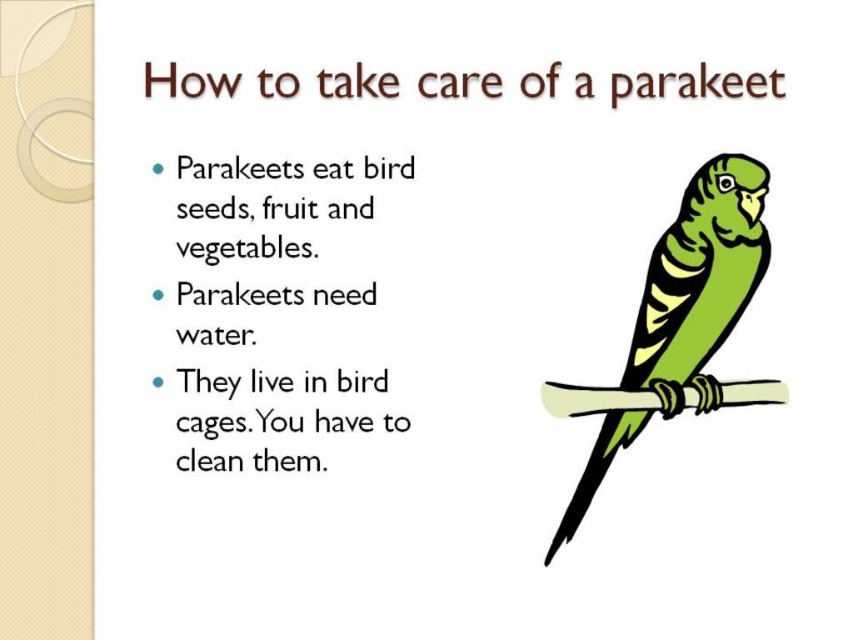
Question: Among these points, which one is farthest from the camera?

Choices:
 (A) (613, 396)
 (B) (648, 300)

Answer: (A)

Question: Can you confirm if green matte parrot at center is wider than white wood branch at center?

Choices:
 (A) no
 (B) yes

Answer: (A)

Question: Does green matte parrot at center have a lesser width compared to white wood branch at center?

Choices:
 (A) yes
 (B) no

Answer: (A)

Question: Which of the following is the closest to the observer?

Choices:
 (A) (704, 211)
 (B) (717, 387)

Answer: (A)

Question: Does green matte parrot at center appear on the left side of white wood branch at center?

Choices:
 (A) yes
 (B) no

Answer: (A)

Question: Which object appears closest to the camera in this image?

Choices:
 (A) white wood branch at center
 (B) green matte parrot at center

Answer: (B)